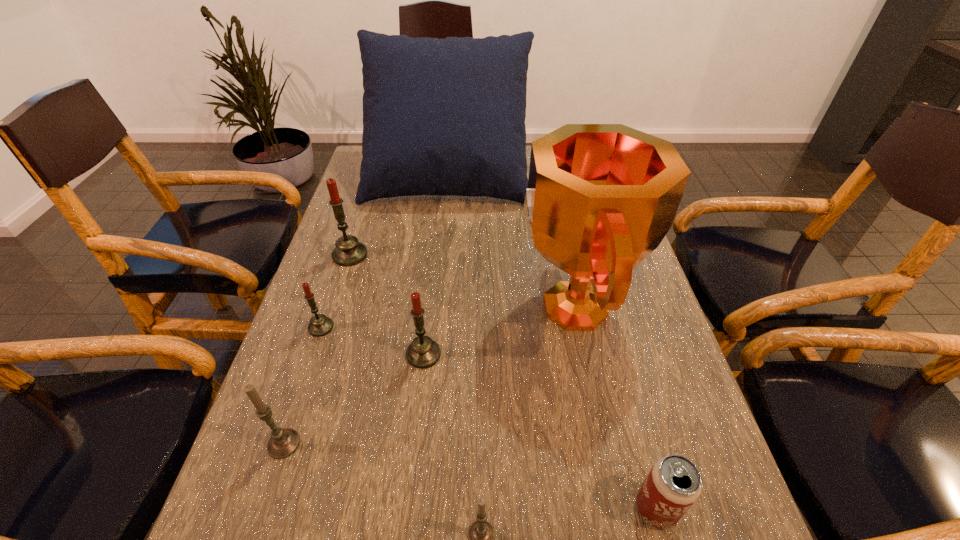
This screenshot has width=960, height=540. I want to click on cushion, so click(x=442, y=117).

Where is `gold award`? This screenshot has width=960, height=540. gold award is located at coordinates (601, 197).

Where is `the tallest candle`? The image size is (960, 540). the tallest candle is located at coordinates (348, 252).

Identify the location of the third tallest object. (348, 252).

Where is `the third nearest candle`? This screenshot has height=540, width=960. the third nearest candle is located at coordinates (423, 352).

Where is `the fourth candle from left to right`? the fourth candle from left to right is located at coordinates (423, 352).

You are a GUI agent. You are given a task and a screenshot of the screen. Output one action in this format:
    pyautogui.click(x=<x>, y=<y>)
    Task: Click on the farther gray candle
    This screenshot has width=960, height=540.
    Given the screenshot: What is the action you would take?
    coord(283,442)

I want to click on the third nearest object, so click(283, 442).

Identify the location of the fourth nearest candle. This screenshot has width=960, height=540. (320, 325).

You are a GUI agent. You are given a task and a screenshot of the screen. Output one action in this format:
    pyautogui.click(x=<x>, y=<y>)
    Task: Click on the smallest red candle
    This screenshot has width=960, height=540.
    Given the screenshot: What is the action you would take?
    pyautogui.click(x=320, y=325)